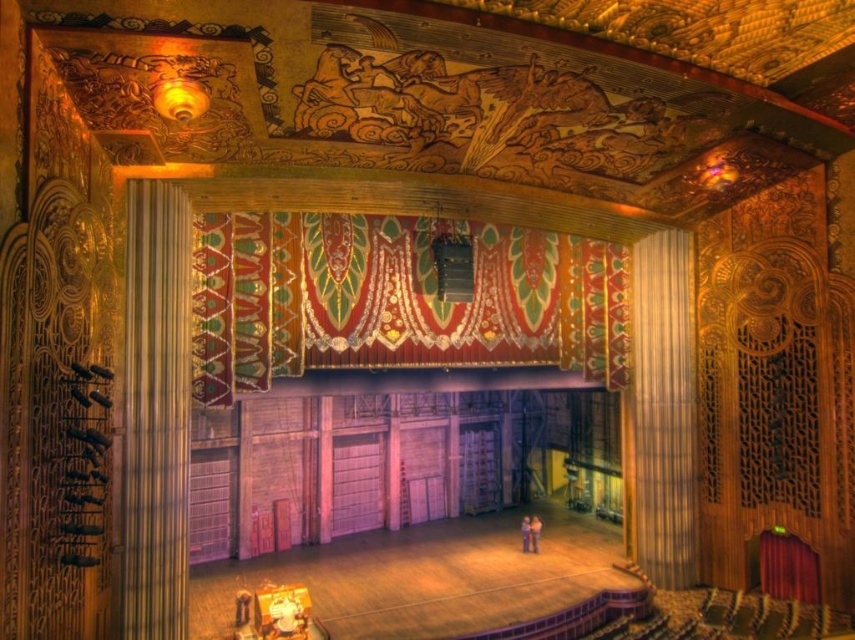
Based on the photo, does velvet tapestry at center have a greater width compared to gold textured curtain at right?

In fact, velvet tapestry at center might be narrower than gold textured curtain at right.

Between velvet tapestry at center and gold textured curtain at right, which one appears on the right side from the viewer's perspective?

gold textured curtain at right is more to the right.

Between point (292, 304) and point (673, 285), which one is positioned in front?

Point (292, 304) is in front.

Where is `velvet tapestry at center`? velvet tapestry at center is located at coordinates (394, 300).

Who is more forward, [156,243] or [691,371]?

Point [156,243] is more forward.

Identify the location of gold textured curtain at left. (155, 412).

Which is in front, point (183, 621) or point (688, 406)?

Point (183, 621)

In order to click on gold textured curtain at left in this screenshot , I will do `click(155, 412)`.

Is velvet tapestry at center above gold textured curtain at left?

Indeed, velvet tapestry at center is positioned over gold textured curtain at left.

Who is positioned more to the right, velvet tapestry at center or gold textured curtain at left?

velvet tapestry at center

Is point (343, 353) less distant than point (149, 394)?

No, it is not.

This screenshot has height=640, width=855. Find the location of `velvet tapestry at center`. velvet tapestry at center is located at coordinates (394, 300).